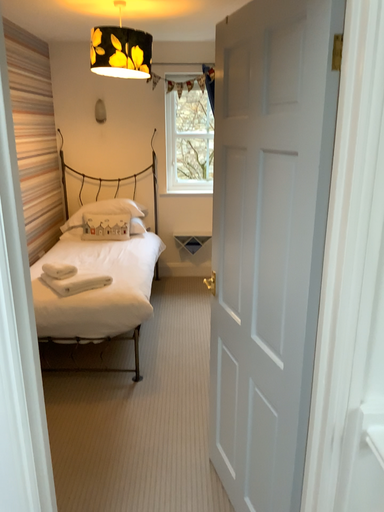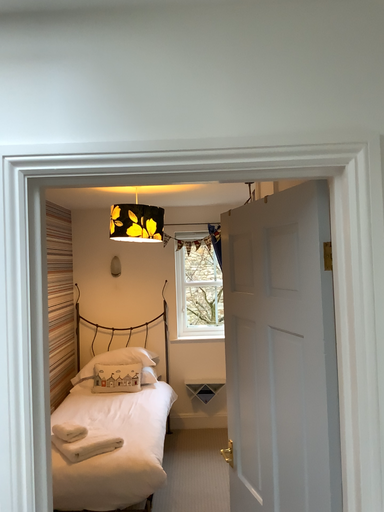
Question: How did the camera likely rotate when shooting the video?

Choices:
 (A) rotated downward
 (B) rotated upward

Answer: (B)